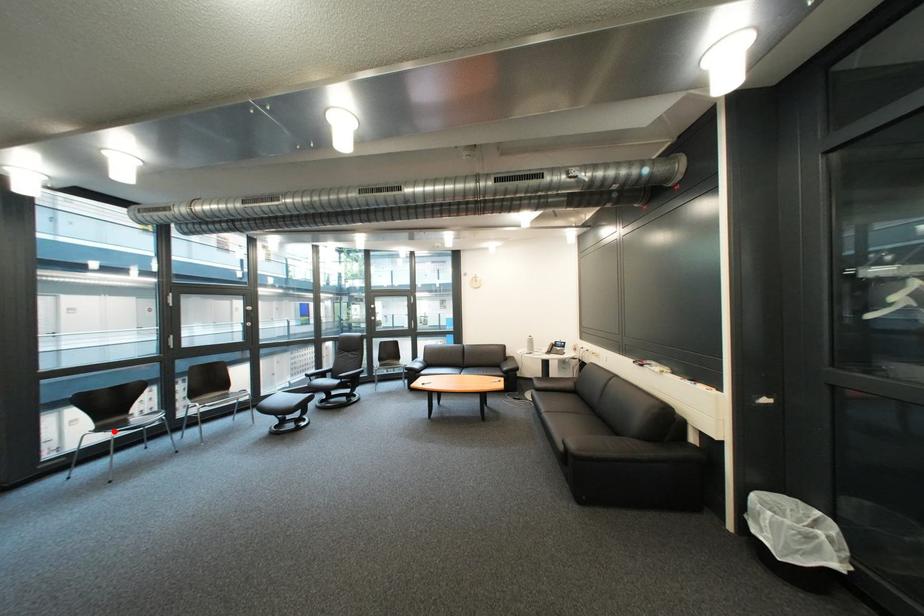
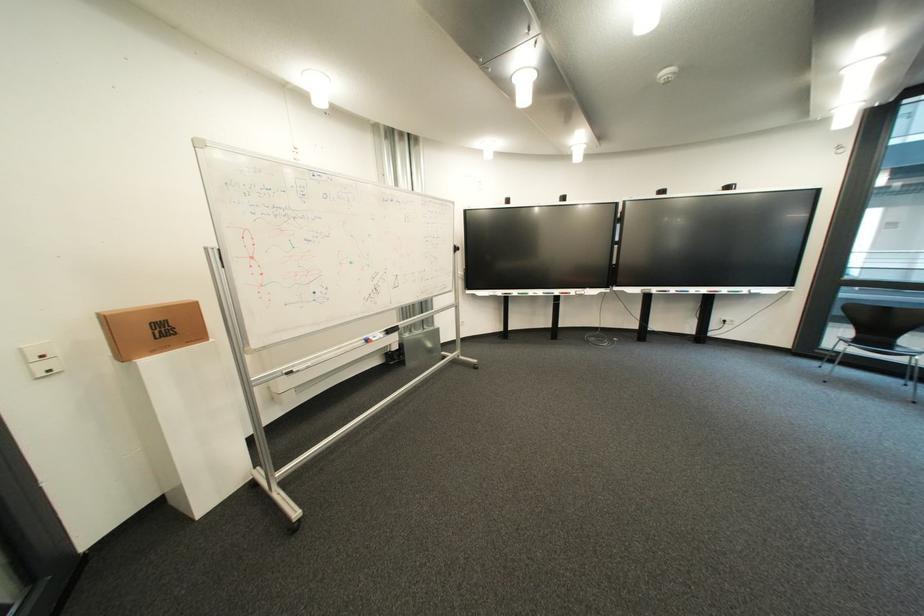
Question: I am providing you with two images of the same scene from different viewpoints. A red point is shown in image1. For the corresponding object point in image2, is it positioned nearer or farther from the camera?

Choices:
 (A) Nearer
 (B) Farther

Answer: (B)